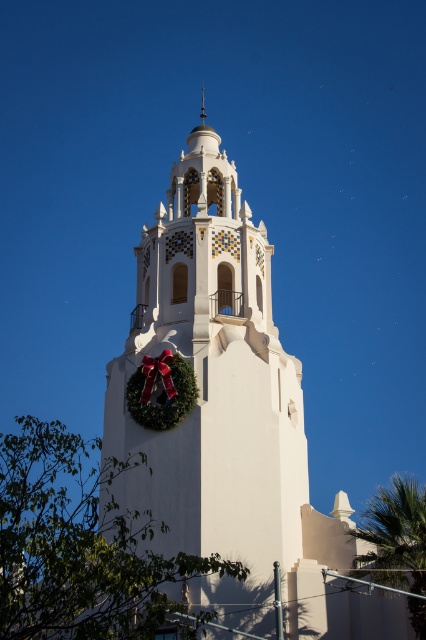
You are standing in front of the white matte tower at center and the green leafy palm tree at lower right. Which object is taller?

The white matte tower at center is taller than the green leafy palm tree at lower right.

You are standing in front of the white matte tower at center and the green leafy palm tree at lower right. Which object is closer to the sky?

The white matte tower at center is closer to the sky because it is positioned over the green leafy palm tree at lower right.

You are standing in front of the white matte tower at center and want to take a photo of the green leafy palm tree at lower right. Which object is closer to you, the photographer, so that you can focus on it properly?

The white matte tower at center is closer to you than the green leafy palm tree at lower right, so you should focus on the white matte tower at center to capture it clearly.